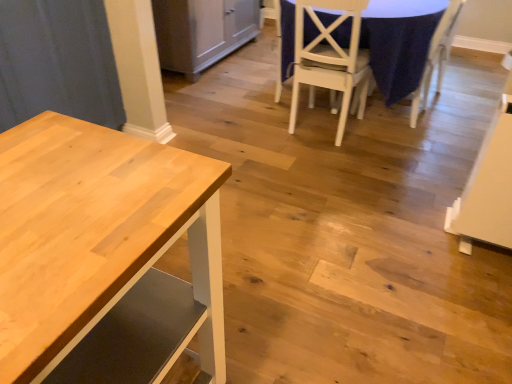
Question: Visually, is white matte chair at center, the 1th chair from the left, positioned to the left or to the right of matte gray cabinet at center?

Choices:
 (A) left
 (B) right

Answer: (B)

Question: Is white matte chair at center, the 2th chair viewed from the right, situated inside matte gray cabinet at center or outside?

Choices:
 (A) inside
 (B) outside

Answer: (B)

Question: Which object is the farthest from the natural wood table at left?

Choices:
 (A) blue fabric tablecloth at center
 (B) matte gray cabinet at center
 (C) white fabric chair at upper right, the 1th chair in the right-to-left sequence
 (D) white matte chair at center, the 1th chair from the left

Answer: (B)

Question: Which object is the farthest from the natural wood table at left?

Choices:
 (A) matte gray cabinet at center
 (B) white matte chair at center, the 2th chair viewed from the right
 (C) white fabric chair at upper right, acting as the 2th chair starting from the left
 (D) blue fabric tablecloth at center

Answer: (A)